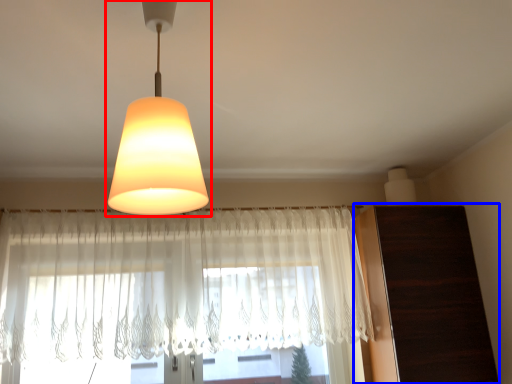
Question: Which object is closer to the camera taking this photo, lamp (highlighted by a red box) or dresser (highlighted by a blue box)?

Choices:
 (A) lamp
 (B) dresser

Answer: (A)